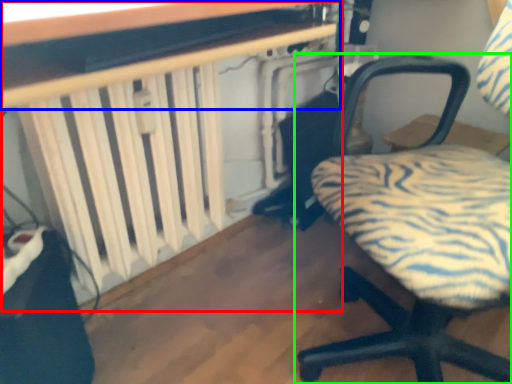
Question: Considering the real-world distances, which object is farthest from table (highlighted by a red box)? table (highlighted by a blue box) or chair (highlighted by a green box)?

Choices:
 (A) table
 (B) chair

Answer: (B)